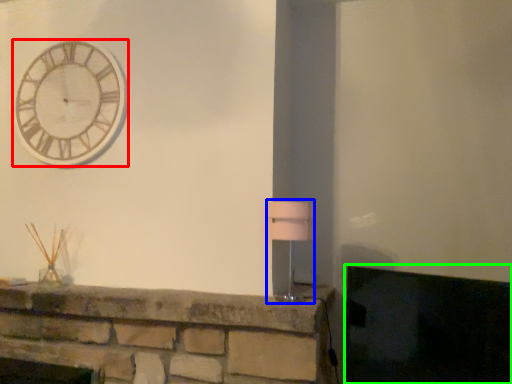
Question: Which object is positioned closest to wall clock (highlighted by a red box)? Select from table lamp (highlighted by a blue box) and fireplace (highlighted by a green box).

Choices:
 (A) table lamp
 (B) fireplace

Answer: (A)